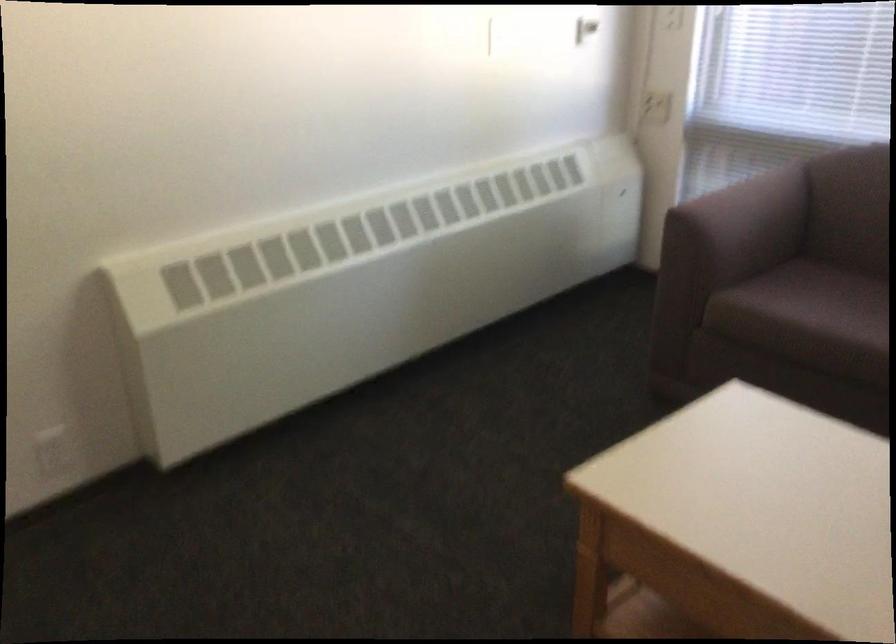
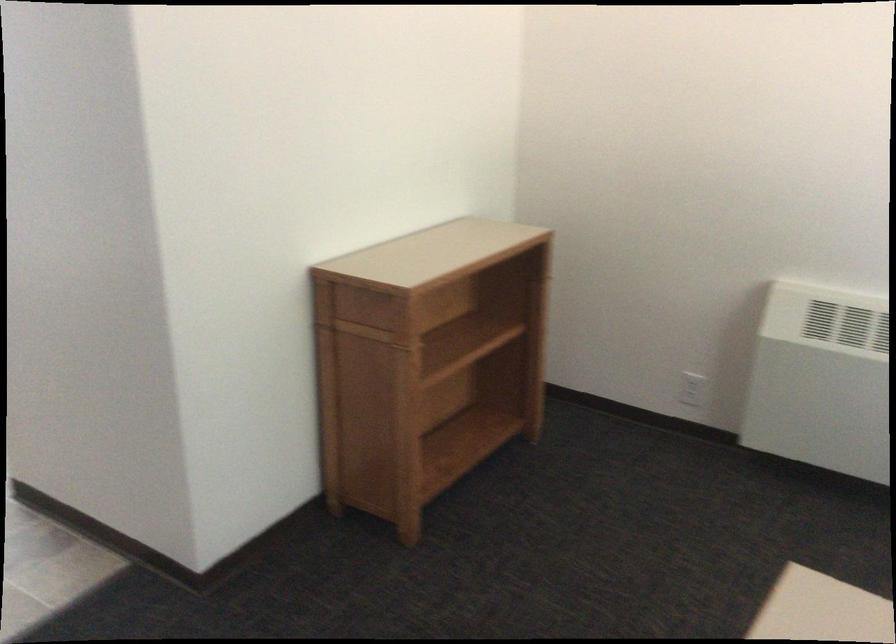
The point at (78, 453) is marked in the first image. Where is the corresponding point in the second image?

(692, 389)